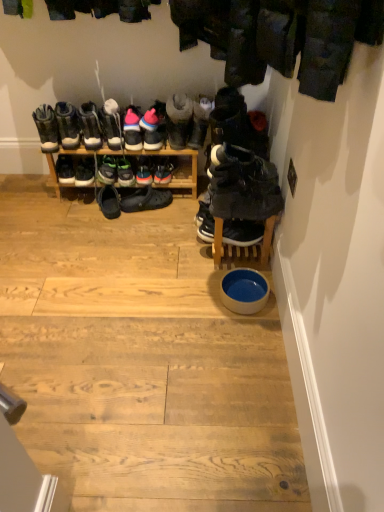
At what (x,y) coordinates should I click in order to perform the action: click on empty space that is ontop of black suede sneakers at center, which is the 1th footwear in right-to-left order (from a real-world perspective). Please return your answer as a coordinate pair (x, y). Looking at the image, I should click on (241, 158).